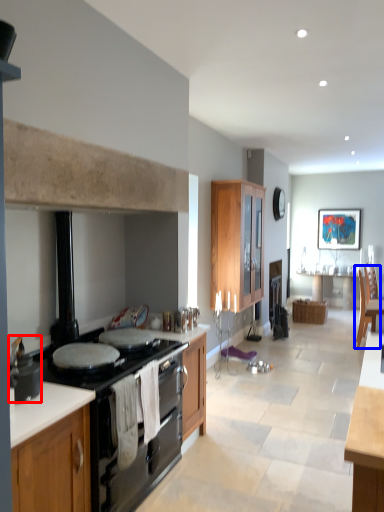
Question: Which object appears closest to the camera in this image, pot/pan (highlighted by a red box) or armchair (highlighted by a blue box)?

Choices:
 (A) pot/pan
 (B) armchair

Answer: (A)